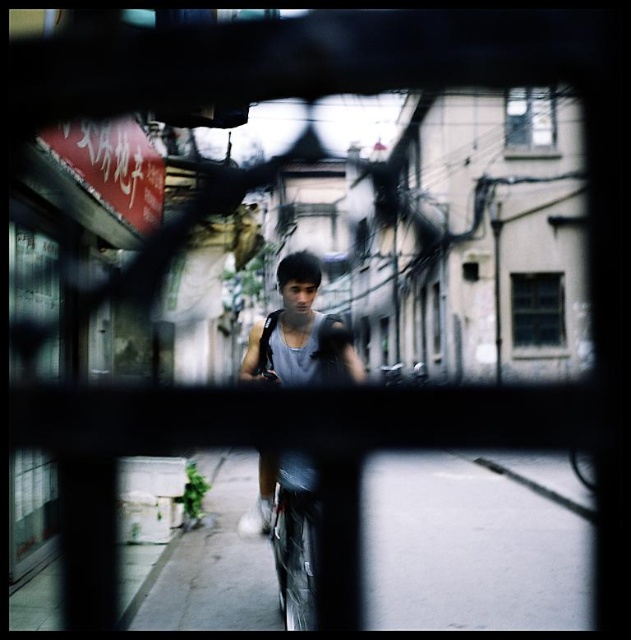
Question: Does gray concrete pavement at lower center have a smaller size compared to gray matte tank top at center?

Choices:
 (A) yes
 (B) no

Answer: (A)

Question: Can you confirm if gray concrete pavement at lower center is thinner than gray matte tank top at center?

Choices:
 (A) yes
 (B) no

Answer: (B)

Question: Which point is closer to the camera taking this photo?

Choices:
 (A) tap(285, 360)
 (B) tap(180, 588)

Answer: (A)

Question: Is gray concrete pavement at lower center thinner than gray matte tank top at center?

Choices:
 (A) no
 (B) yes

Answer: (A)

Question: Among these objects, which one is nearest to the camera?

Choices:
 (A) gray concrete pavement at lower center
 (B) gray matte tank top at center

Answer: (B)